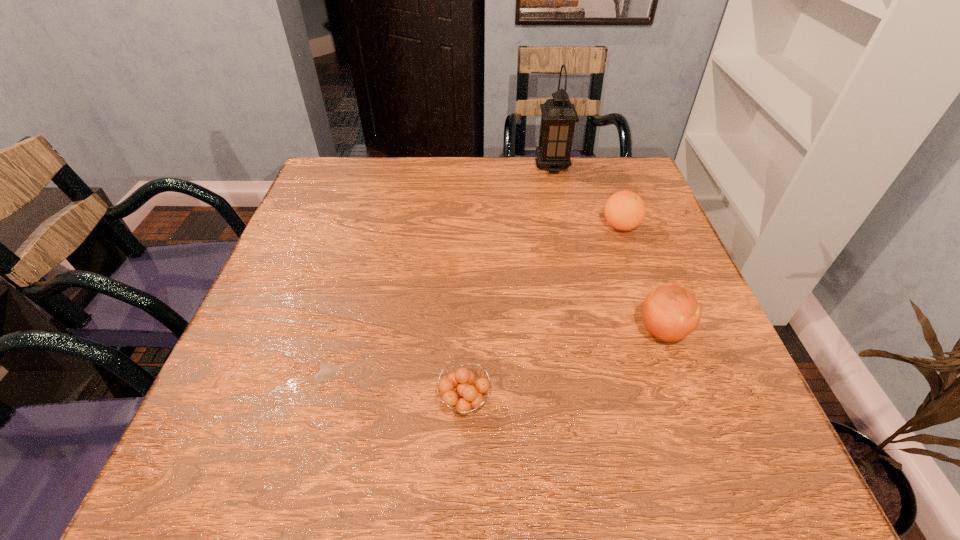
The image size is (960, 540). Find the location of `free space between the leftmost object and the farthest orange fruit`. free space between the leftmost object and the farthest orange fruit is located at coordinates (542, 314).

Locate an element on the screen. This screenshot has height=540, width=960. free space between the tallest object and the shortest object is located at coordinates (x=509, y=284).

Where is `free point between the nearest object and the farthest orange fruit`? free point between the nearest object and the farthest orange fruit is located at coordinates (542, 314).

The width and height of the screenshot is (960, 540). What are the coordinates of `vacant area that lies between the shortest orange fruit and the second tallest orange fruit` in the screenshot? It's located at (542, 314).

I want to click on free space between the tallest orange fruit and the third nearest object, so click(x=641, y=279).

The width and height of the screenshot is (960, 540). What are the coordinates of `vacant space that's between the third farthest object and the tallest object` in the screenshot? It's located at (608, 249).

I want to click on vacant space in between the shortest orange fruit and the second tallest object, so click(x=564, y=366).

You are a GUI agent. You are given a task and a screenshot of the screen. Output one action in this format:
    pyautogui.click(x=<x>, y=<y>)
    Task: Click on the vacant point located between the lantern and the third nearest object
    The height and width of the screenshot is (540, 960).
    Given the screenshot: What is the action you would take?
    pyautogui.click(x=587, y=196)

Locate an element on the screen. This screenshot has height=540, width=960. vacant region between the leftmost orange fruit and the tallest object is located at coordinates (509, 284).

Find the location of a particular element. The image size is (960, 540). vacant point located between the second object from left to right and the nearest object is located at coordinates (509, 284).